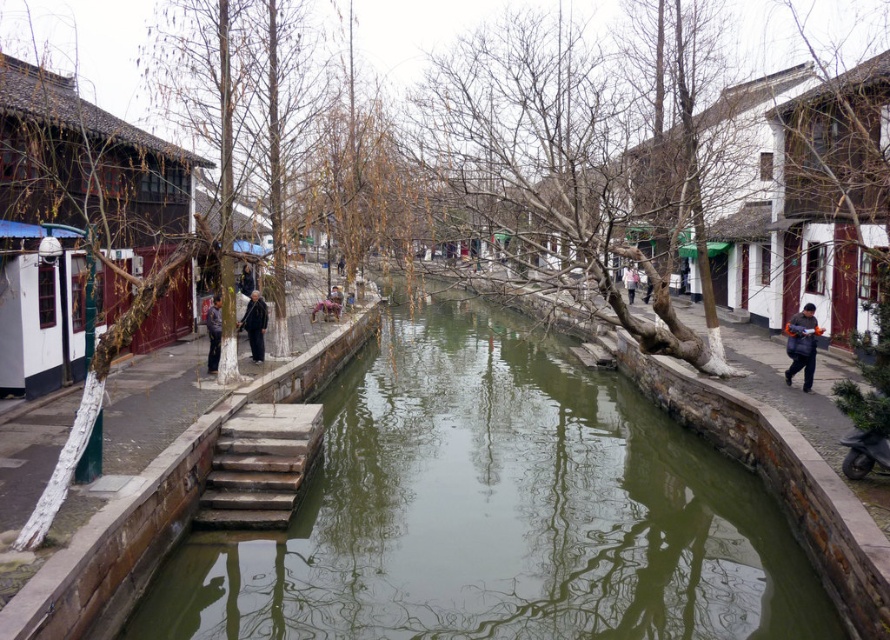
Who is positioned more to the right, wooden stairs at center or dark blue jacket at left?

From the viewer's perspective, wooden stairs at center appears more on the right side.

Which of these two, wooden stairs at center or dark blue jacket at left, stands shorter?

dark blue jacket at left is shorter.

What do you see at coordinates (259, 465) in the screenshot?
I see `wooden stairs at center` at bounding box center [259, 465].

Locate an element on the screen. This screenshot has height=640, width=890. wooden stairs at center is located at coordinates point(259,465).

Which is behind, point (289, 477) or point (621, 278)?

Positioned behind is point (621, 278).

Does wooden stairs at center appear over light brown leather jacket at center?

No, wooden stairs at center is not above light brown leather jacket at center.

Locate an element on the screen. Image resolution: width=890 pixels, height=640 pixels. wooden stairs at center is located at coordinates (259, 465).

I want to click on wooden stairs at center, so click(259, 465).

Is green stone river at center closer to camera compared to light brown leather jacket at center?

That is True.

Which is above, green stone river at center or light brown leather jacket at center?

light brown leather jacket at center is above.

Where is `green stone river at center`? The width and height of the screenshot is (890, 640). green stone river at center is located at coordinates (498, 512).